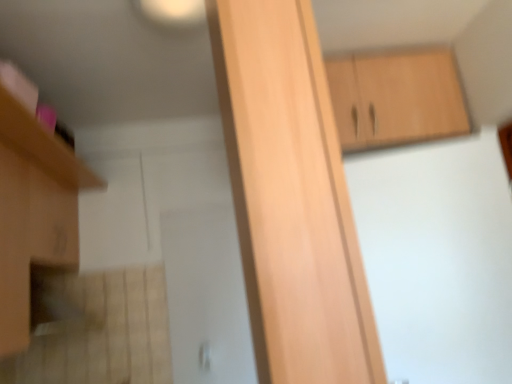
Question: Considering the positions of light wood cabinet at center, arranged as the 1th cabinetry when viewed from the front, and light brown wood cabinet at upper right, which ranks as the 3th cabinetry in left-to-right order, in the image, is light wood cabinet at center, arranged as the 1th cabinetry when viewed from the front, bigger or smaller than light brown wood cabinet at upper right, which ranks as the 3th cabinetry in left-to-right order,?

Choices:
 (A) small
 (B) big

Answer: (A)

Question: From the image's perspective, is light wood cabinet at center, arranged as the 2th cabinetry when viewed from the right, above or below light brown wood cabinet at upper right, which ranks as the first cabinetry in right-to-left order?

Choices:
 (A) above
 (B) below

Answer: (B)

Question: Estimate the real-world distances between objects in this image. Which object is closer to the matte wood cabinet at left, marked as the second cabinetry in a front-to-back arrangement?

Choices:
 (A) light brown wood cabinet at upper right, placed as the first cabinetry when sorted from back to front
 (B) light wood cabinet at center, arranged as the 1th cabinetry when viewed from the front

Answer: (B)

Question: Which object is positioned farthest from the light brown wood cabinet at upper right, which ranks as the first cabinetry in right-to-left order?

Choices:
 (A) light wood cabinet at center, which is the 2th cabinetry in left-to-right order
 (B) matte wood cabinet at left, marked as the second cabinetry in a front-to-back arrangement

Answer: (B)